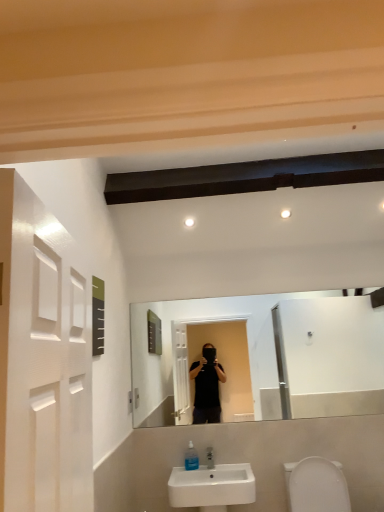
Find the location of `transparent plastic soap dispenser at lower center`. transparent plastic soap dispenser at lower center is located at coordinates (191, 458).

What do you see at coordinates (316, 485) in the screenshot?
I see `white glossy toilet bowl at lower right` at bounding box center [316, 485].

Identify the location of transparent plastic soap dispenser at lower center. Image resolution: width=384 pixels, height=512 pixels. 191,458.

Between point (188, 460) and point (228, 503), which one is positioned in front?

The point (228, 503) is in front.

Is transparent plastic soap dispenser at lower center spatially inside white ceramic sink at lower center, or outside of it?

transparent plastic soap dispenser at lower center is spatially positioned inside white ceramic sink at lower center.

Between transparent plastic soap dispenser at lower center and white ceramic sink at lower center, which one has less height?

transparent plastic soap dispenser at lower center.

Is transparent plastic soap dispenser at lower center in front of or behind white ceramic sink at lower center in the image?

transparent plastic soap dispenser at lower center is positioned farther from the viewer than white ceramic sink at lower center.

Is transparent plastic soap dispenser at lower center next to white glossy toilet bowl at lower right and touching it?

No, transparent plastic soap dispenser at lower center is not with white glossy toilet bowl at lower right.

Between point (186, 454) and point (307, 470), which one is positioned behind?

Point (186, 454)

Does transparent plastic soap dispenser at lower center have a greater width compared to white glossy toilet bowl at lower right?

No.

Is transparent plastic soap dispenser at lower center aimed at white glossy toilet bowl at lower right?

No.

Which is closer to the camera, (317, 495) or (251, 488)?

The point (251, 488) is more forward.

How much distance is there between white glossy toilet bowl at lower right and white ceramic sink at lower center?

18.30 inches.

Are white glossy toilet bowl at lower right and white ceramic sink at lower center making contact?

They are not placed beside each other.

How many degrees apart are the facing directions of white glossy toilet bowl at lower right and white ceramic sink at lower center?

The angle between the facing direction of white glossy toilet bowl at lower right and the facing direction of white ceramic sink at lower center is 0.0296 degrees.

Considering the relative sizes of white ceramic sink at lower center and white glossy toilet bowl at lower right in the image provided, is white ceramic sink at lower center wider than white glossy toilet bowl at lower right?

Incorrect, the width of white ceramic sink at lower center does not surpass that of white glossy toilet bowl at lower right.

Can you tell me how much white ceramic sink at lower center and white glossy toilet bowl at lower right differ in facing direction?

0.0296 degrees separate the facing orientations of white ceramic sink at lower center and white glossy toilet bowl at lower right.

From the image's perspective, which object appears higher, white ceramic sink at lower center or white glossy toilet bowl at lower right?

white glossy toilet bowl at lower right is shown above in the image.

From a real-world perspective, is white ceramic sink at lower center physically located above or below transparent plastic soap dispenser at lower center?

white ceramic sink at lower center is situated lower than transparent plastic soap dispenser at lower center in the real world.

The height and width of the screenshot is (512, 384). In order to click on sink in front of the transparent plastic soap dispenser at lower center in this screenshot , I will do `click(212, 487)`.

Does white ceramic sink at lower center come in front of transparent plastic soap dispenser at lower center?

That is True.

Which of these two, white ceramic sink at lower center or transparent plastic soap dispenser at lower center, is thinner?

With smaller width is transparent plastic soap dispenser at lower center.

From the image's perspective, which is below, white glossy toilet bowl at lower right or transparent plastic soap dispenser at lower center?

white glossy toilet bowl at lower right is shown below in the image.

Is white glossy toilet bowl at lower right positioned beyond the bounds of transparent plastic soap dispenser at lower center?

Yes, white glossy toilet bowl at lower right is not within transparent plastic soap dispenser at lower center.

From a real-world perspective, is white glossy toilet bowl at lower right located beneath transparent plastic soap dispenser at lower center?

Yes, from a real-world perspective, white glossy toilet bowl at lower right is beneath transparent plastic soap dispenser at lower center.

Where is `sink on the right of transparent plastic soap dispenser at lower center`? sink on the right of transparent plastic soap dispenser at lower center is located at coordinates (212, 487).

Where is `soap dispenser above the white glossy toilet bowl at lower right (from the image's perspective)`? soap dispenser above the white glossy toilet bowl at lower right (from the image's perspective) is located at coordinates (191, 458).

In the scene shown: When comparing their distances from transparent plastic soap dispenser at lower center, does white ceramic sink at lower center or white glossy toilet bowl at lower right seem further?

white glossy toilet bowl at lower right.

Based on their spatial positions, is transparent plastic soap dispenser at lower center or white glossy toilet bowl at lower right further from white ceramic sink at lower center?

Based on the image, white glossy toilet bowl at lower right appears to be further to white ceramic sink at lower center.

Looking at the image, which one is located further to white glossy toilet bowl at lower right, white ceramic sink at lower center or transparent plastic soap dispenser at lower center?

transparent plastic soap dispenser at lower center.

Based on their spatial positions, is transparent plastic soap dispenser at lower center or white ceramic sink at lower center closer to white glossy toilet bowl at lower right?

Based on the image, white ceramic sink at lower center appears to be nearer to white glossy toilet bowl at lower right.

Estimate the real-world distances between objects in this image. Which object is closer to white ceramic sink at lower center, white glossy toilet bowl at lower right or transparent plastic soap dispenser at lower center?

Based on the image, transparent plastic soap dispenser at lower center appears to be nearer to white ceramic sink at lower center.

Consider the image. From the image, which object appears to be nearer to transparent plastic soap dispenser at lower center, white glossy toilet bowl at lower right or white ceramic sink at lower center?

Based on the image, white ceramic sink at lower center appears to be nearer to transparent plastic soap dispenser at lower center.

Image resolution: width=384 pixels, height=512 pixels. Find the location of `sink between transparent plastic soap dispenser at lower center and white glossy toilet bowl at lower right from left to right`. sink between transparent plastic soap dispenser at lower center and white glossy toilet bowl at lower right from left to right is located at coordinates (212, 487).